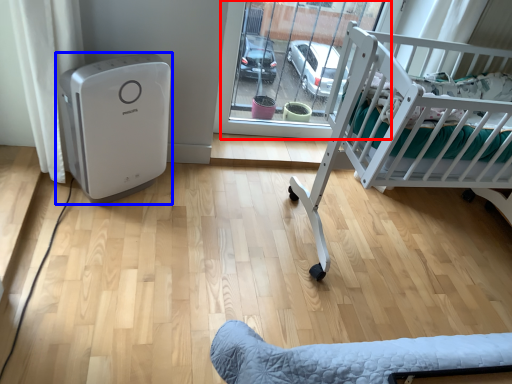
Question: Among these objects, which one is farthest to the camera, glass door (highlighted by a red box) or home appliance (highlighted by a blue box)?

Choices:
 (A) glass door
 (B) home appliance

Answer: (A)